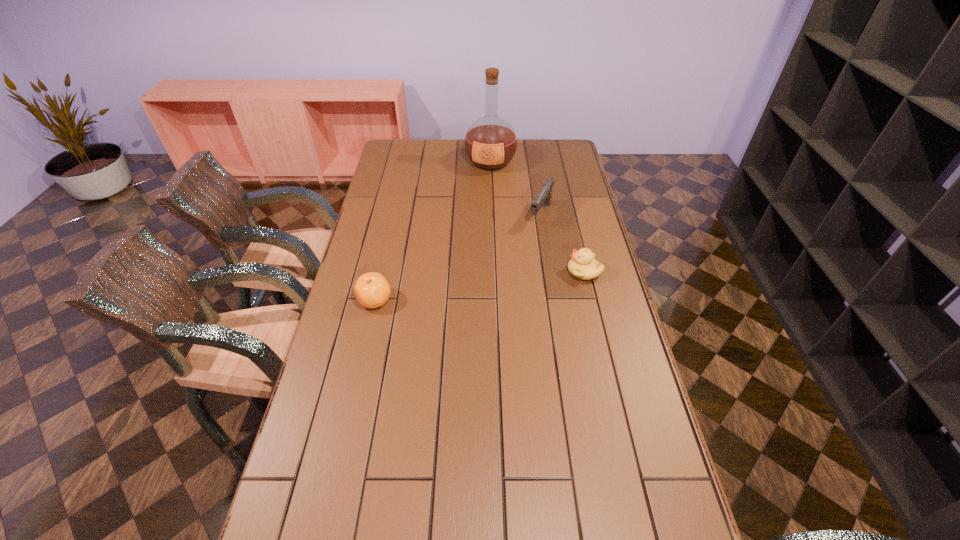
Locate an element on the screen. This screenshot has width=960, height=540. blank space located on the beak of the duckling is located at coordinates (474, 272).

Where is `vacant area located 0.090m on the beak of the duckling`? The height and width of the screenshot is (540, 960). vacant area located 0.090m on the beak of the duckling is located at coordinates (541, 272).

Find the location of a particular element. The width and height of the screenshot is (960, 540). blank area located 0.260m in the direction the third nearest object is aimed is located at coordinates (511, 272).

Locate an element on the screen. This screenshot has height=540, width=960. free location located 0.360m in the direction the third nearest object is aimed is located at coordinates (499, 291).

Where is `free space located 0.050m in the direction the third nearest object is aimed`? Image resolution: width=960 pixels, height=540 pixels. free space located 0.050m in the direction the third nearest object is aimed is located at coordinates (532, 237).

Where is `vacant space located on the front label of the second object from left to right`? The image size is (960, 540). vacant space located on the front label of the second object from left to right is located at coordinates point(483,194).

At what (x,y) coordinates should I click in order to perform the action: click on vacant space located 0.130m on the front label of the second object from left to right. Please return your answer as a coordinate pair (x, y). The height and width of the screenshot is (540, 960). Looking at the image, I should click on (483, 192).

Locate an element on the screen. The width and height of the screenshot is (960, 540). free space located 0.200m on the front label of the second object from left to right is located at coordinates (481, 202).

Identify the location of object located at the far edge. (490, 143).

This screenshot has width=960, height=540. I want to click on object located in the left edge section of the desktop, so click(372, 290).